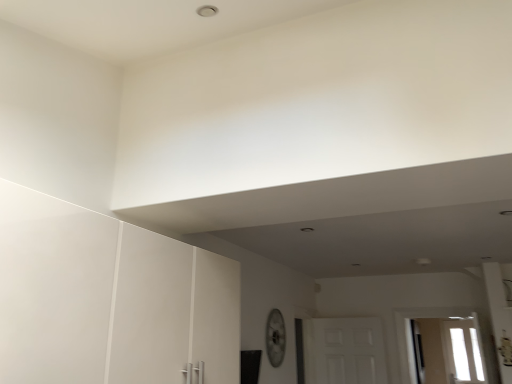
Question: Can you confirm if white matte door at center is bigger than transparent glass window at lower right?

Choices:
 (A) no
 (B) yes

Answer: (B)

Question: Can you confirm if white matte door at center is positioned to the left of transparent glass window at lower right?

Choices:
 (A) yes
 (B) no

Answer: (A)

Question: Can you confirm if white matte door at center is shorter than transparent glass window at lower right?

Choices:
 (A) yes
 (B) no

Answer: (A)

Question: Is white matte door at center at the right side of transparent glass window at lower right?

Choices:
 (A) no
 (B) yes

Answer: (A)

Question: Can you confirm if white matte door at center is smaller than transparent glass window at lower right?

Choices:
 (A) no
 (B) yes

Answer: (A)

Question: Is white matte door at center positioned behind transparent glass window at lower right?

Choices:
 (A) no
 (B) yes

Answer: (A)

Question: Considering the relative sizes of transparent glass window at lower right and white matte door at center in the image provided, is transparent glass window at lower right smaller than white matte door at center?

Choices:
 (A) yes
 (B) no

Answer: (A)

Question: Is transparent glass window at lower right turned away from white matte door at center?

Choices:
 (A) yes
 (B) no

Answer: (B)

Question: Considering the relative sizes of transparent glass window at lower right and white matte door at center in the image provided, is transparent glass window at lower right taller than white matte door at center?

Choices:
 (A) no
 (B) yes

Answer: (B)

Question: Does transparent glass window at lower right appear on the left side of white matte door at center?

Choices:
 (A) yes
 (B) no

Answer: (B)

Question: Does transparent glass window at lower right have a greater width compared to white matte door at center?

Choices:
 (A) yes
 (B) no

Answer: (B)

Question: Can you confirm if transparent glass window at lower right is shorter than white matte door at center?

Choices:
 (A) no
 (B) yes

Answer: (A)

Question: Considering the relative positions of transparent glass window at lower right and white matte door at center in the image provided, is transparent glass window at lower right to the left or to the right of white matte door at center?

Choices:
 (A) left
 (B) right

Answer: (B)